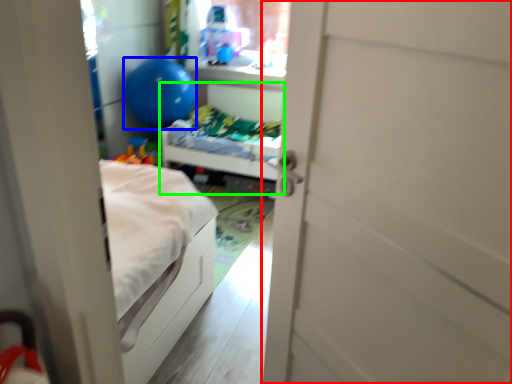
Question: Considering the real-world distances, which object is farthest from door (highlighted by a red box)? balloon (highlighted by a blue box) or hospital bed (highlighted by a green box)?

Choices:
 (A) balloon
 (B) hospital bed

Answer: (A)